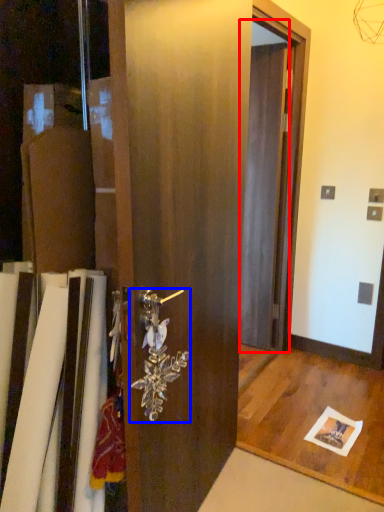
Question: Which object appears closest to the camera in this image, screen door (highlighted by a red box) or door handle (highlighted by a blue box)?

Choices:
 (A) screen door
 (B) door handle

Answer: (B)